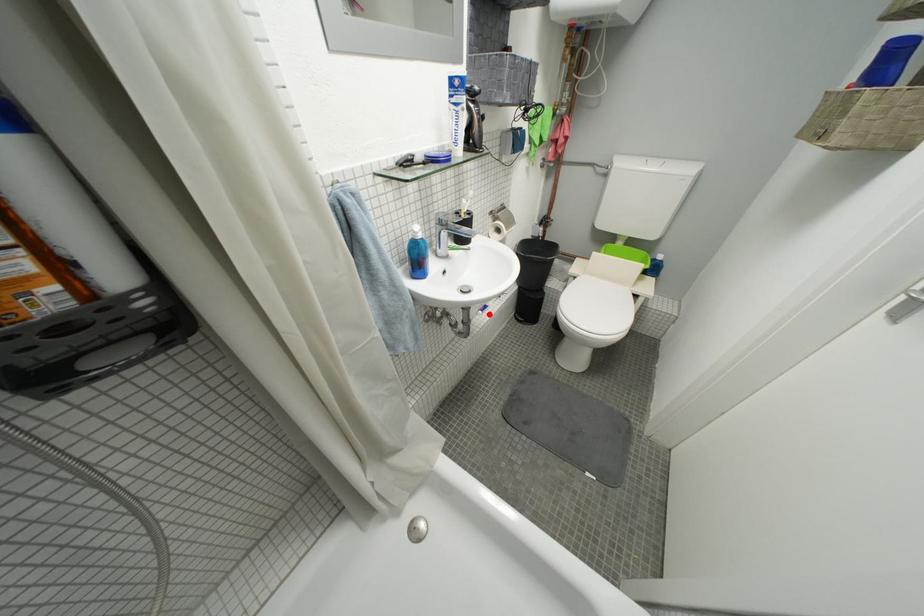
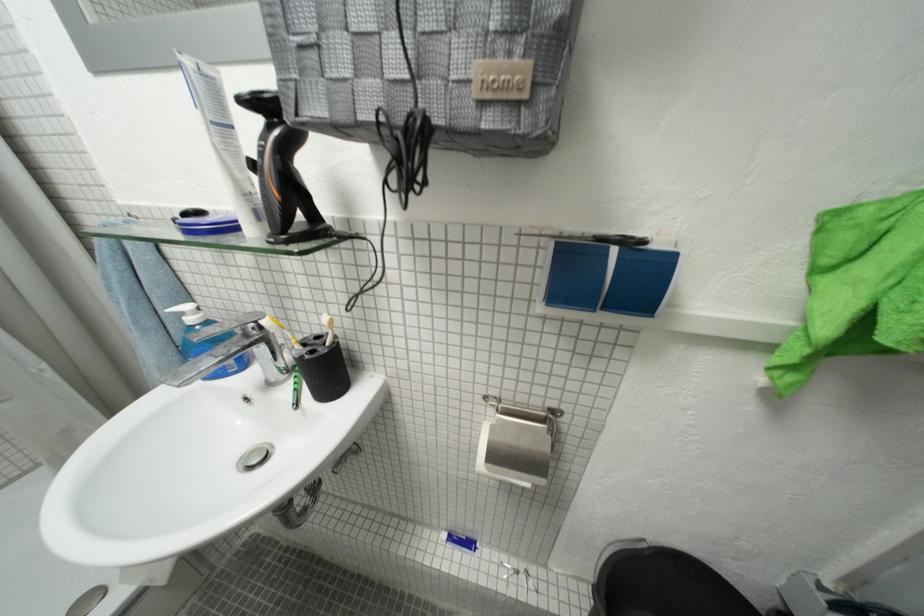
Question: I am providing you with two images of the same scene from different viewpoints. In image1, a red point is highlighted. Considering the same 3D point in image2, which of the following is correct?

Choices:
 (A) It is closer
 (B) It is farther

Answer: (B)